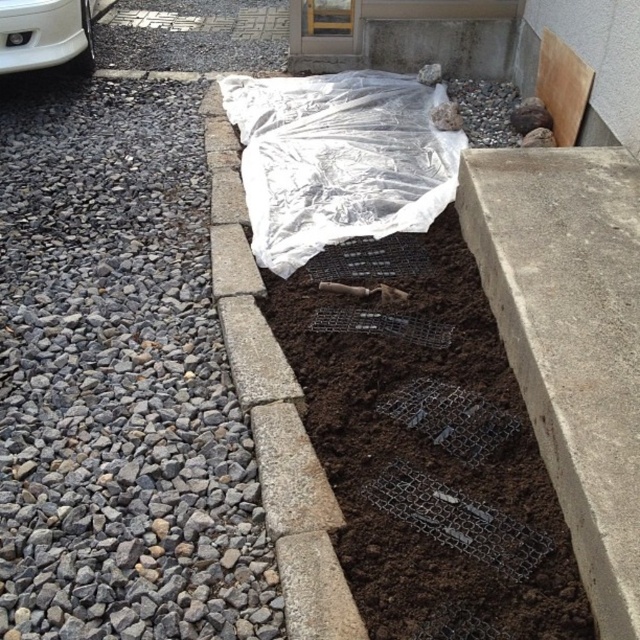
Who is more forward, (406, 141) or (330, 636)?

Point (330, 636) is in front.

Who is positioned more to the left, transparent plastic at center or gray concrete curb at center?

gray concrete curb at center is more to the left.

Is point (301, 140) closer to camera compared to point (250, 385)?

That is False.

The width and height of the screenshot is (640, 640). I want to click on transparent plastic at center, so click(x=339, y=160).

Between point (305, 598) and point (60, 19), which one is positioned in front?

Positioned in front is point (305, 598).

Looking at this image, can you confirm if gray concrete curb at center is positioned to the right of white glossy bumper at upper left?

Correct, you'll find gray concrete curb at center to the right of white glossy bumper at upper left.

Who is more forward, (243, 369) or (44, 60)?

Point (243, 369) is more forward.

Where is `gray concrete curb at center`? The height and width of the screenshot is (640, 640). gray concrete curb at center is located at coordinates (273, 410).

Which is more to the right, transparent plastic at center or white glossy bumper at upper left?

transparent plastic at center

Is transparent plastic at center positioned at the back of white glossy bumper at upper left?

No, transparent plastic at center is closer to the viewer.

Which is in front, point (323, 90) or point (38, 4)?

Positioned in front is point (38, 4).

Find the location of a particular element. transparent plastic at center is located at coordinates (339, 160).